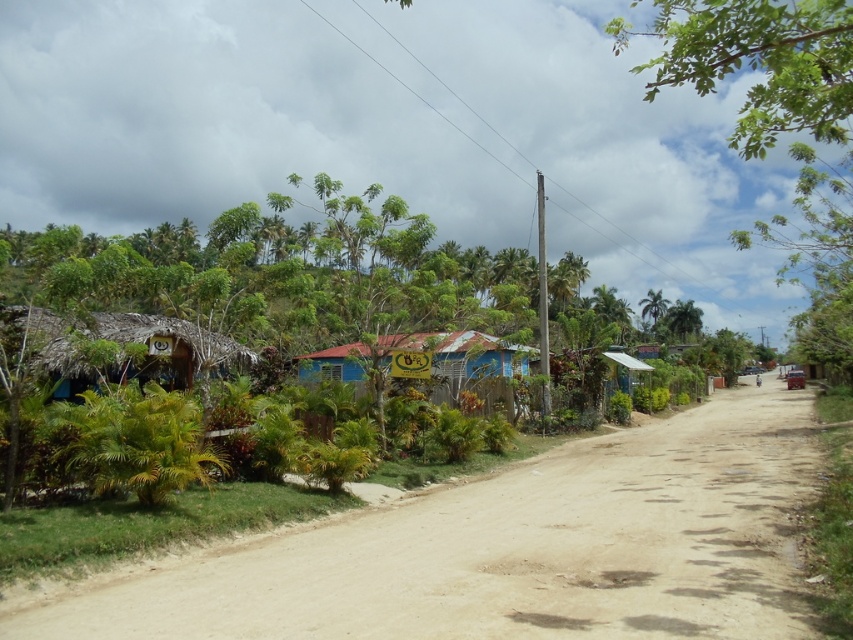
Question: Is brown sandy dirt track at center closer to camera compared to thatched roof hut at left?

Choices:
 (A) no
 (B) yes

Answer: (B)

Question: Which object is closer to the camera taking this photo?

Choices:
 (A) brown sandy dirt track at center
 (B) blue corrugated metal hut at center

Answer: (A)

Question: Among these points, which one is nearest to the camera?

Choices:
 (A) (45, 353)
 (B) (448, 488)

Answer: (A)

Question: Is brown sandy dirt track at center wider than thatched roof hut at left?

Choices:
 (A) yes
 (B) no

Answer: (A)

Question: Among these objects, which one is farthest from the camera?

Choices:
 (A) blue corrugated metal hut at center
 (B) thatched roof hut at left

Answer: (A)

Question: Does brown sandy dirt track at center have a larger size compared to blue corrugated metal hut at center?

Choices:
 (A) no
 (B) yes

Answer: (B)